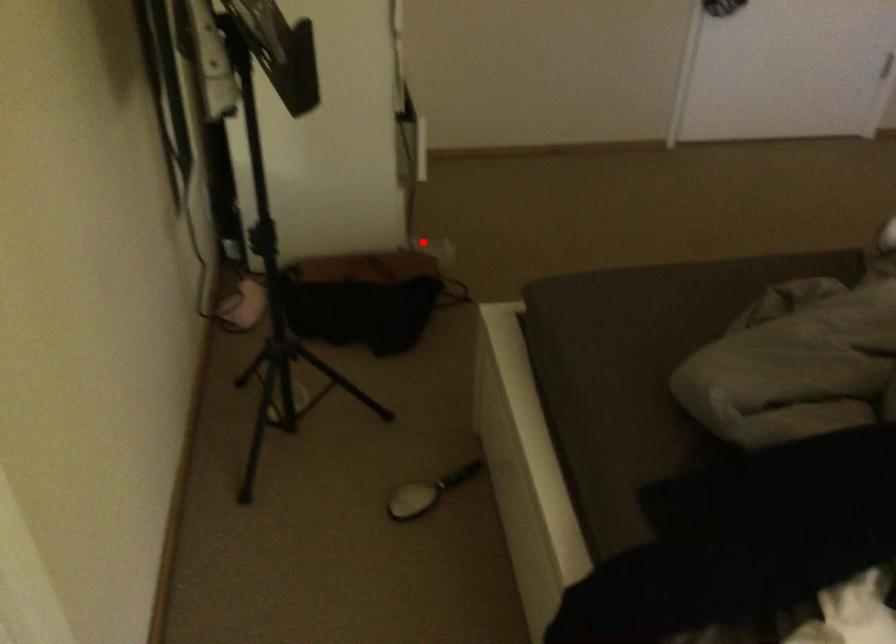
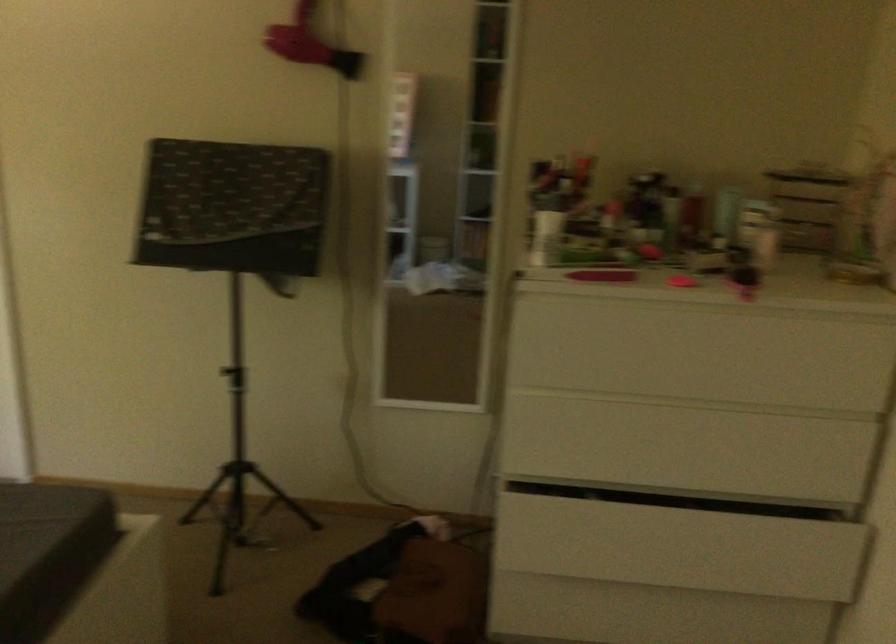
Question: I am providing you with two images of the same scene from different viewpoints. Image1 has a red point marked. In image2, the corresponding 3D location appears at what relative position? Reply with the corresponding letter.

Choices:
 (A) Closer
 (B) Farther

Answer: (A)